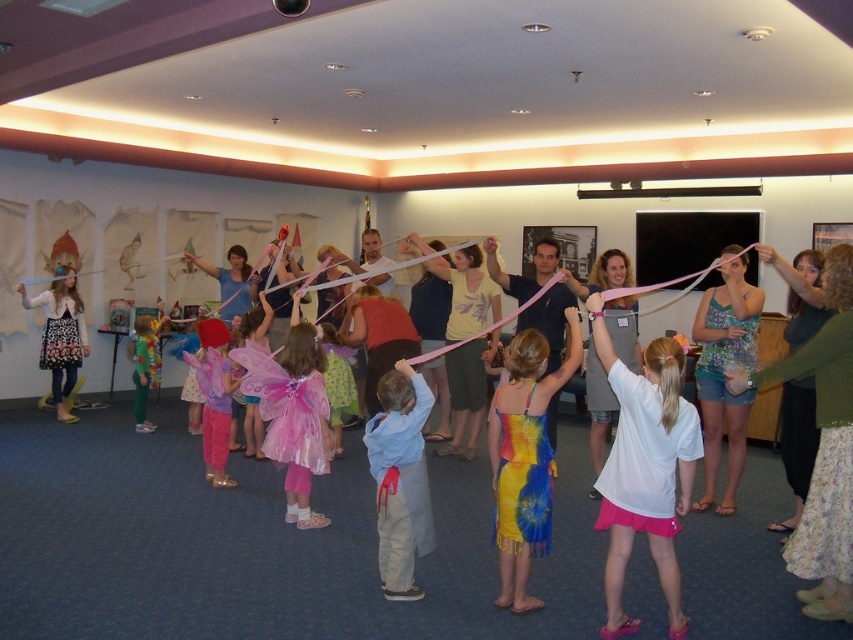
Question: Which point is farther from the camera taking this photo?

Choices:
 (A) (525, 365)
 (B) (55, 326)
 (C) (733, 312)
 (D) (675, 612)

Answer: (B)

Question: Which object is the closest to the floral dress at left?

Choices:
 (A) tie-dye fabric dress at center
 (B) floral tank top at center

Answer: (A)

Question: Does white matte t-shirt at center appear on the left side of tie-dye fabric dress at center?

Choices:
 (A) no
 (B) yes

Answer: (A)

Question: Which object is closer to the camera taking this photo?

Choices:
 (A) floral tank top at center
 (B) tie-dye fabric dress at center

Answer: (B)

Question: Does tie-dye fabric dress at center have a lesser width compared to floral dress at left?

Choices:
 (A) yes
 (B) no

Answer: (A)

Question: Can you confirm if white matte t-shirt at center is thinner than floral dress at left?

Choices:
 (A) yes
 (B) no

Answer: (A)